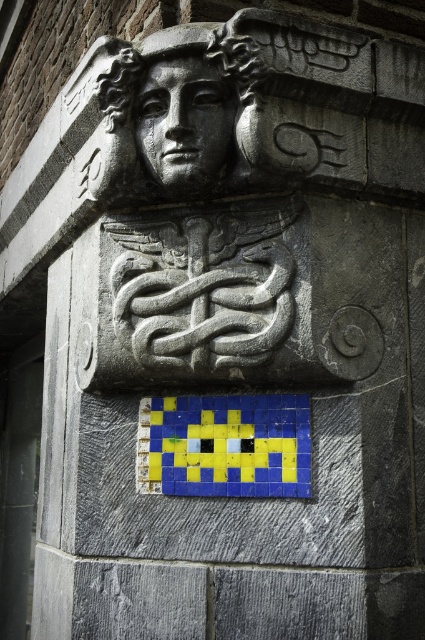
Question: Can you confirm if pixelated yellow tile at center is positioned above gray stone face at center?

Choices:
 (A) no
 (B) yes

Answer: (A)

Question: Does pixelated yellow tile at center have a greater width compared to gray stone face at center?

Choices:
 (A) yes
 (B) no

Answer: (A)

Question: From the image, what is the correct spatial relationship of pixelated yellow tile at center in relation to gray stone face at center?

Choices:
 (A) below
 (B) above

Answer: (A)